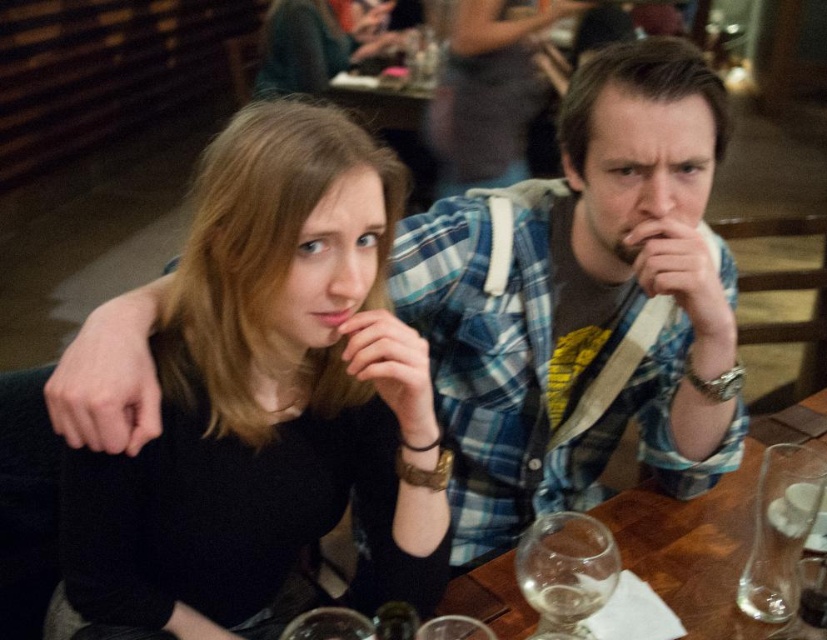
Can you confirm if wooden table at center is bigger than transparent glass at lower right?

Yes, wooden table at center is bigger than transparent glass at lower right.

Image resolution: width=827 pixels, height=640 pixels. Find the location of `wooden table at center`. wooden table at center is located at coordinates (706, 531).

Who is more distant from viewer, (620, 502) or (790, 460)?

Point (620, 502)

At what (x,y) coordinates should I click in order to perform the action: click on wooden table at center. Please return your answer as a coordinate pair (x, y). The width and height of the screenshot is (827, 640). Looking at the image, I should click on (706, 531).

Measure the distance from black matte shirt at center to wooden table at center.

black matte shirt at center and wooden table at center are 14.49 inches apart.

Where is `black matte shirt at center`? The height and width of the screenshot is (640, 827). black matte shirt at center is located at coordinates (268, 396).

Does black matte shirt at center appear on the right side of transparent glass wine glass at lower center?

Incorrect, black matte shirt at center is not on the right side of transparent glass wine glass at lower center.

Is point (443, 552) less distant than point (539, 573)?

No.

You are a GUI agent. You are given a task and a screenshot of the screen. Output one action in this format:
    pyautogui.click(x=<x>, y=<y>)
    Task: Click on the black matte shirt at center
    The image size is (827, 640).
    Given the screenshot: What is the action you would take?
    click(268, 396)